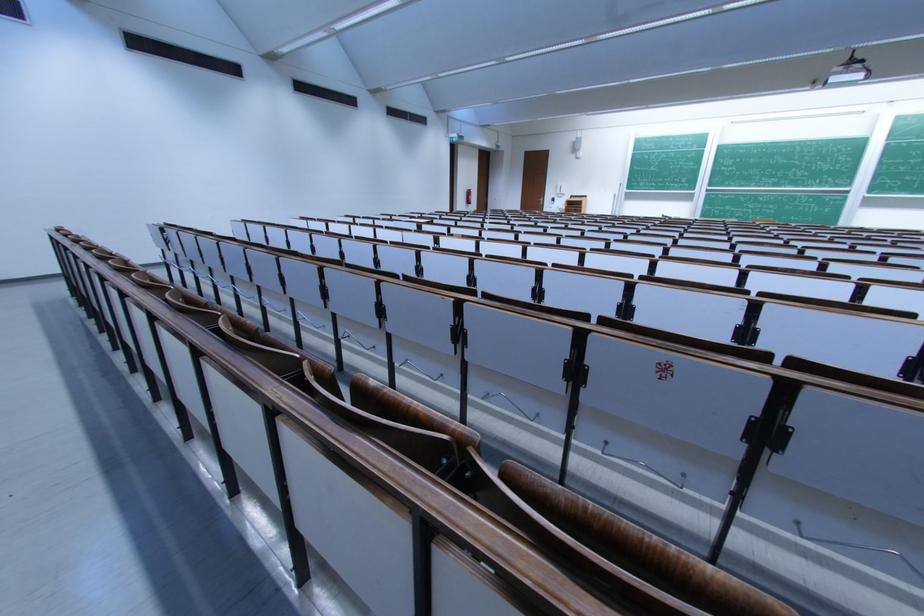
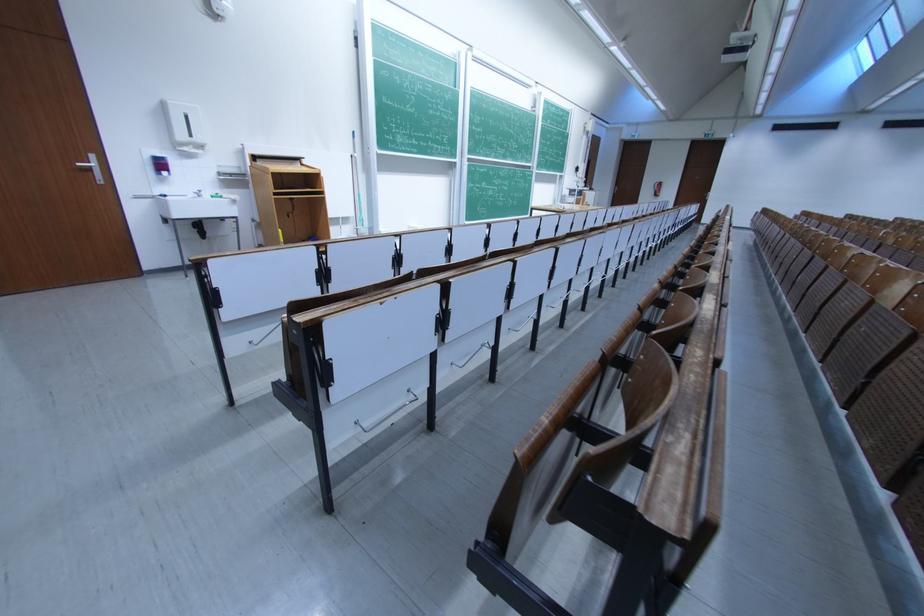
In the second image, find the point that corresponds to the point at 570,195 in the first image.

(205, 142)